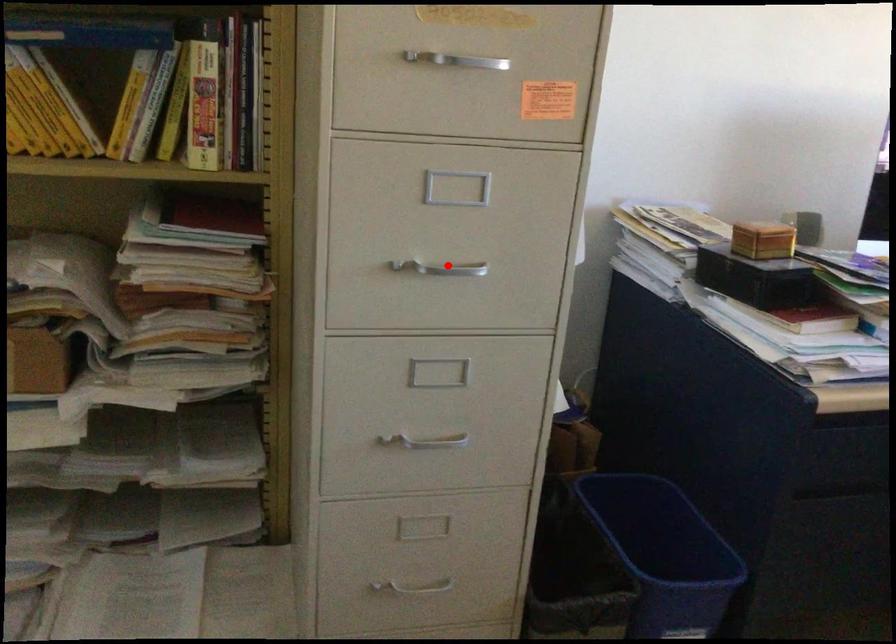
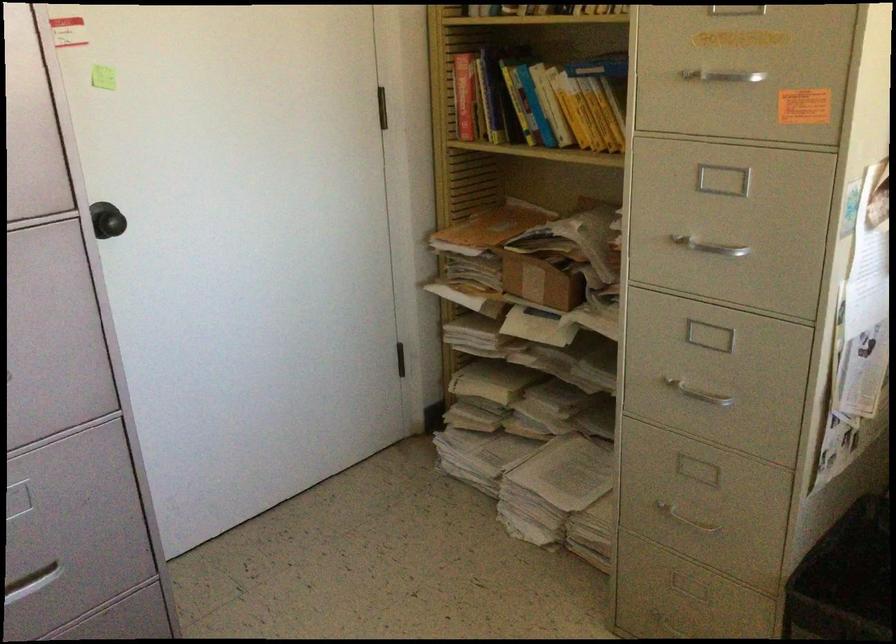
Find the pixel in the second image that matches the highlighted location in the first image.

(710, 248)